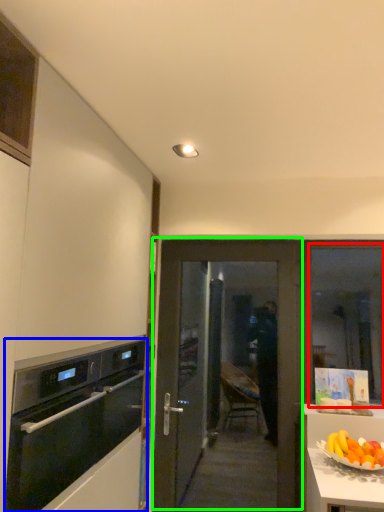
Question: Which object is positioned farthest from window (highlighted by a red box)? Select from kitchen appliance (highlighted by a blue box) and door (highlighted by a green box).

Choices:
 (A) kitchen appliance
 (B) door

Answer: (A)